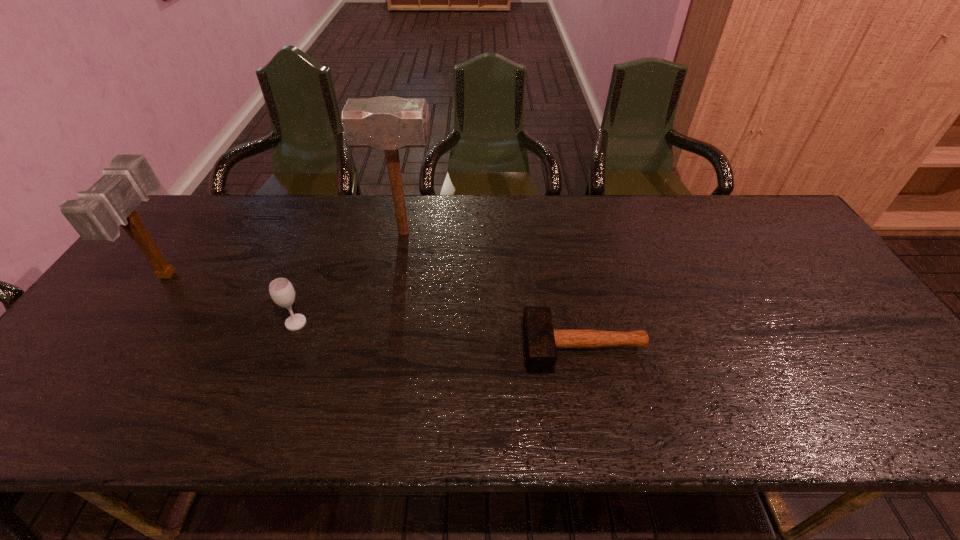
Find the location of a particular element. This screenshot has height=540, width=960. the farthest object is located at coordinates (385, 123).

This screenshot has height=540, width=960. Identify the location of the tallest mallet. (385, 123).

Locate an element on the screen. the leftmost mallet is located at coordinates (x=96, y=215).

Where is `the second tallest mallet`? the second tallest mallet is located at coordinates (96, 215).

I want to click on wineglass, so click(x=281, y=290).

Locate an element on the screen. the second object from left to right is located at coordinates (281, 290).

This screenshot has width=960, height=540. What are the coordinates of `the rightmost mallet` in the screenshot? It's located at (541, 341).

I want to click on the shortest object, so click(541, 341).

Locate an element on the screen. vacant space situated 0.200m on the striking face of the second mallet from left to right is located at coordinates (502, 233).

Image resolution: width=960 pixels, height=540 pixels. I want to click on free spot located on the right of the leftmost mallet, so click(224, 274).